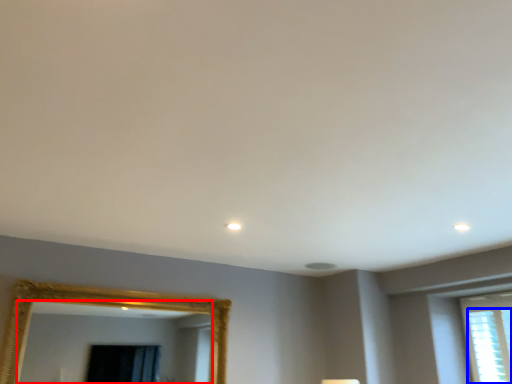
Question: Among these objects, which one is farthest to the camera, mirror (highlighted by a red box) or window (highlighted by a blue box)?

Choices:
 (A) mirror
 (B) window

Answer: (B)